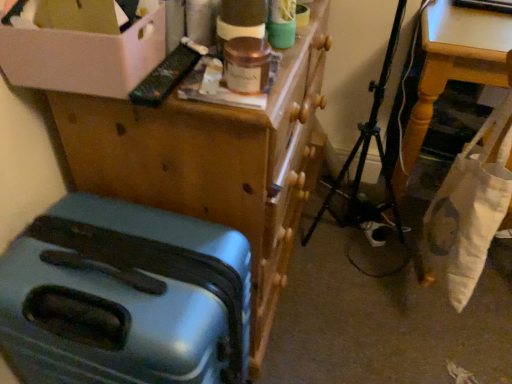
Question: Is teal plastic suitcase at lower left to the right of wooden table at lower right from the viewer's perspective?

Choices:
 (A) yes
 (B) no

Answer: (B)

Question: Is teal plastic suitcase at lower left shorter than wooden table at lower right?

Choices:
 (A) no
 (B) yes

Answer: (A)

Question: Is teal plastic suitcase at lower left oriented towards wooden table at lower right?

Choices:
 (A) no
 (B) yes

Answer: (B)

Question: Is teal plastic suitcase at lower left far from wooden table at lower right?

Choices:
 (A) yes
 (B) no

Answer: (B)

Question: Does teal plastic suitcase at lower left have a lesser width compared to wooden table at lower right?

Choices:
 (A) yes
 (B) no

Answer: (A)

Question: Is teal plastic suitcase at lower left placed right next to wooden table at lower right?

Choices:
 (A) yes
 (B) no

Answer: (B)

Question: From a real-world perspective, is white fabric bag at lower right positioned over teal plastic suitcase at lower left based on gravity?

Choices:
 (A) yes
 (B) no

Answer: (A)

Question: Can teal plastic suitcase at lower left be found inside white fabric bag at lower right?

Choices:
 (A) no
 (B) yes

Answer: (A)

Question: Is white fabric bag at lower right further to camera compared to teal plastic suitcase at lower left?

Choices:
 (A) yes
 (B) no

Answer: (A)

Question: Is white fabric bag at lower right far away from teal plastic suitcase at lower left?

Choices:
 (A) yes
 (B) no

Answer: (B)

Question: Is white fabric bag at lower right taller than teal plastic suitcase at lower left?

Choices:
 (A) no
 (B) yes

Answer: (B)

Question: Does white fabric bag at lower right have a smaller size compared to teal plastic suitcase at lower left?

Choices:
 (A) yes
 (B) no

Answer: (A)

Question: Would you say teal plastic suitcase at lower left is part of wooden table at lower right's contents?

Choices:
 (A) no
 (B) yes

Answer: (A)